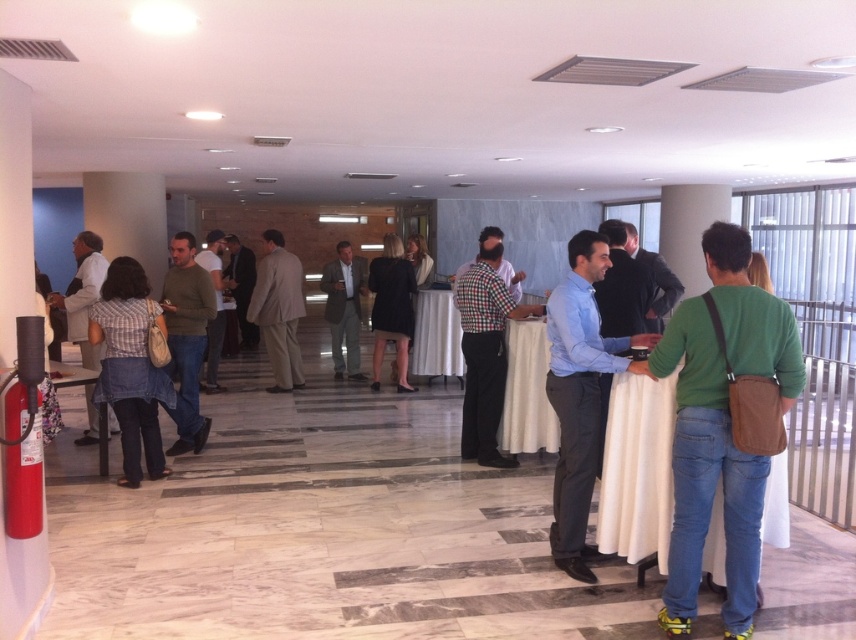
Between matte gray blazer at left and light gray suit at center, which one appears on the right side from the viewer's perspective?

From the viewer's perspective, light gray suit at center appears more on the right side.

Which is in front, point (84, 336) or point (333, 273)?

Point (84, 336) is in front.

You are a GUI agent. You are given a task and a screenshot of the screen. Output one action in this format:
    pyautogui.click(x=<x>, y=<y>)
    Task: Click on the matte gray blazer at left
    
    Given the screenshot: What is the action you would take?
    pyautogui.click(x=82, y=294)

Between point (577, 232) and point (201, 387), which one is positioned in front?

Point (577, 232) is in front.

Is light blue shirt at center to the right of light brown leather jacket at center from the viewer's perspective?

Yes, light blue shirt at center is to the right of light brown leather jacket at center.

Locate an element on the screen. The width and height of the screenshot is (856, 640). light blue shirt at center is located at coordinates (580, 394).

Locate an element on the screen. The width and height of the screenshot is (856, 640). light blue shirt at center is located at coordinates (580, 394).

Does denim shirt at left have a greater height compared to green sweater at center?

Incorrect, denim shirt at left's height is not larger of green sweater at center's.

Who is taller, denim shirt at left or green sweater at center?

Standing taller between the two is green sweater at center.

Does point (111, 355) come behind point (183, 412)?

No, (111, 355) is in front of (183, 412).

In order to click on denim shirt at left in this screenshot , I will do pyautogui.click(x=129, y=368).